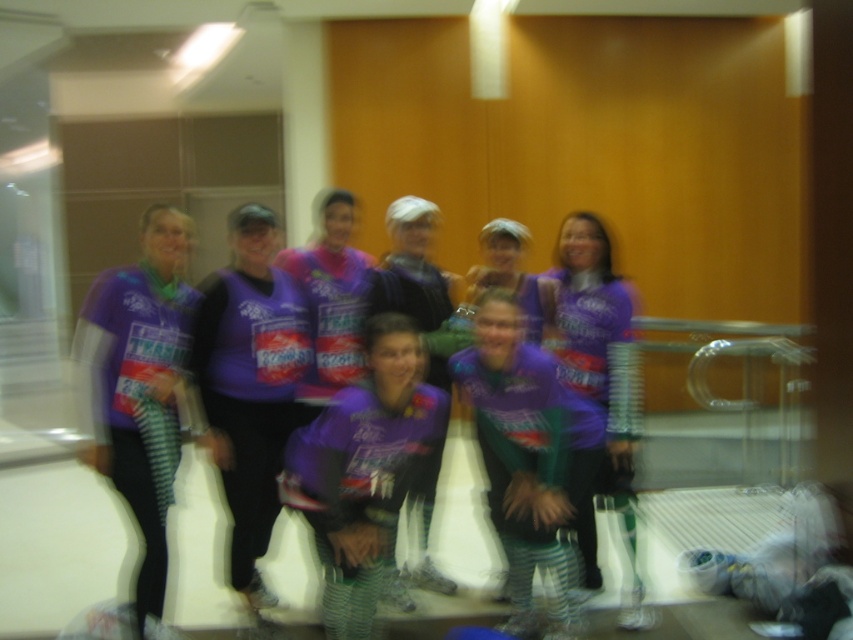
Question: Does matte purple shirt at left have a smaller size compared to purple jersey at center?

Choices:
 (A) yes
 (B) no

Answer: (A)

Question: Which of these objects is positioned farthest from the purple fabric shirt at center?

Choices:
 (A) purple jersey at center
 (B) matte purple shirt at left

Answer: (A)

Question: Among these points, which one is nearest to the camera?

Choices:
 (A) (590, 296)
 (B) (129, 353)
 (C) (231, 337)

Answer: (B)

Question: Can you confirm if purple fabric shirt at center is positioned above purple jersey at center?

Choices:
 (A) yes
 (B) no

Answer: (A)

Question: Does purple fabric shirt at center appear over purple jersey at center?

Choices:
 (A) yes
 (B) no

Answer: (A)

Question: Which of the following is the farthest from the observer?

Choices:
 (A) [x=640, y=588]
 (B) [x=157, y=257]
 (C) [x=242, y=420]

Answer: (A)